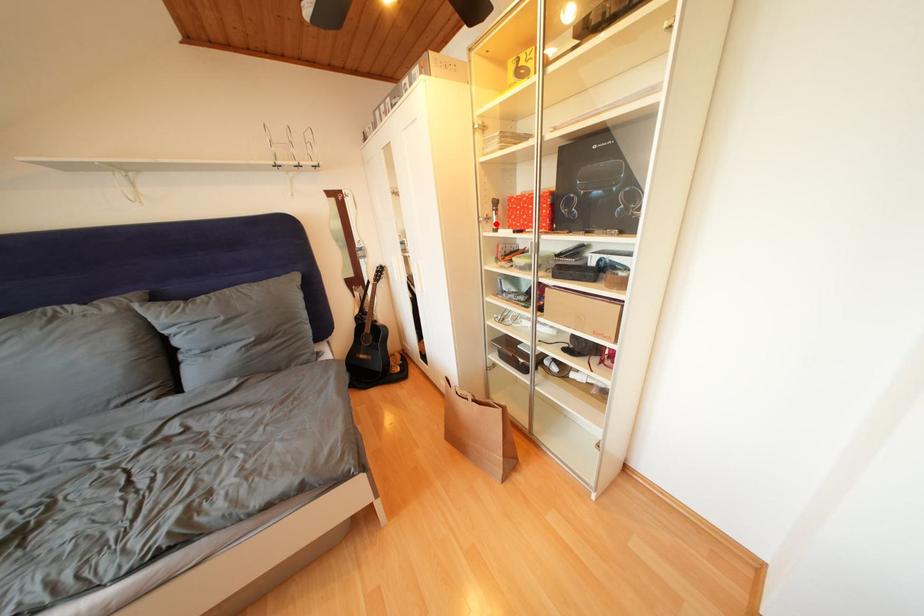
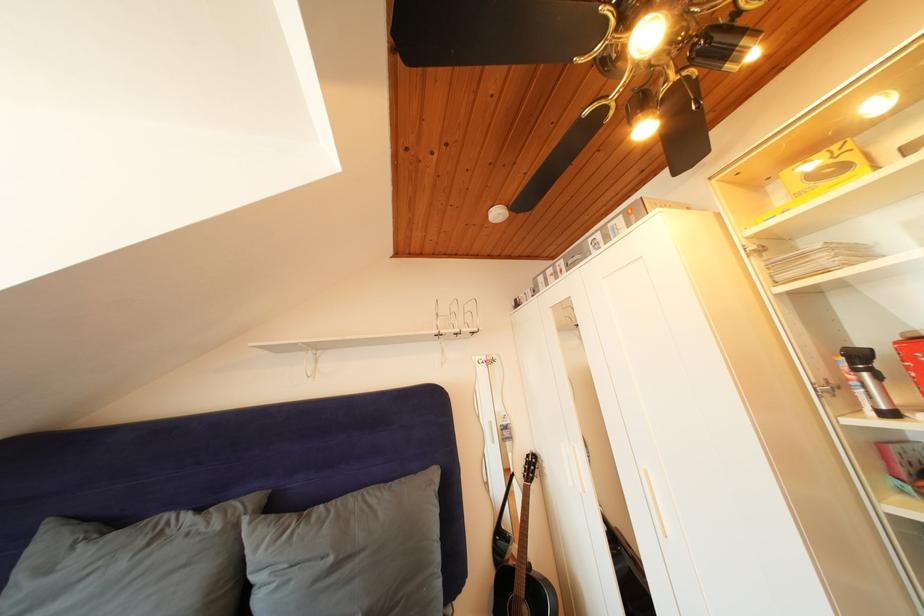
In the second image, find the point that corresponds to the highlighted location in the first image.

(844, 392)